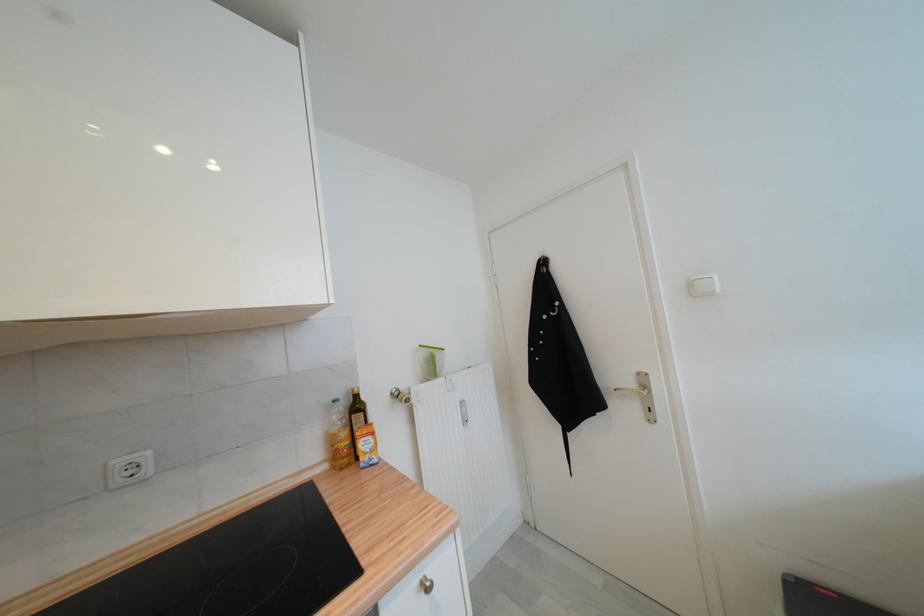
Image resolution: width=924 pixels, height=616 pixels. What are the coordinates of `small paper carton` in the screenshot? It's located at (430, 361).